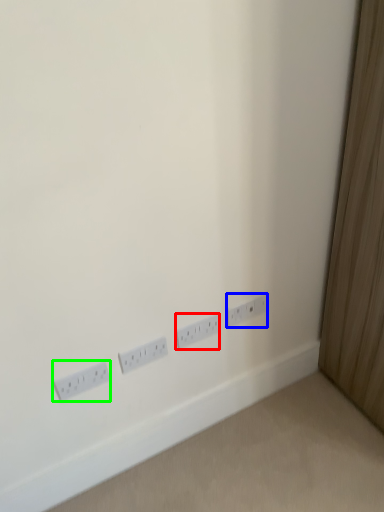
Question: Which is nearer to the power plugs and sockets (highlighted by a red box)? power plugs and sockets (highlighted by a blue box) or power plugs and sockets (highlighted by a green box).

Choices:
 (A) power plugs and sockets
 (B) power plugs and sockets

Answer: (A)